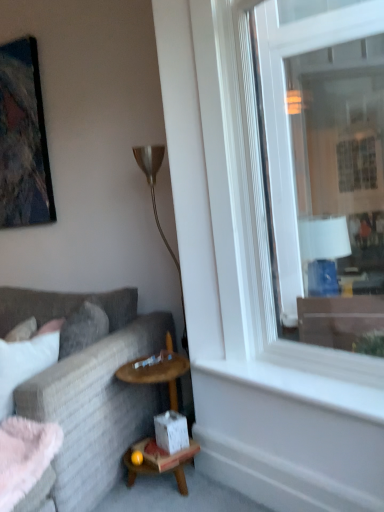
Question: Is metallic gold floor lamp at center turned away from clear glass window at right?

Choices:
 (A) no
 (B) yes

Answer: (A)

Question: Considering the relative sizes of metallic gold floor lamp at center and clear glass window at right in the image provided, is metallic gold floor lamp at center taller than clear glass window at right?

Choices:
 (A) yes
 (B) no

Answer: (B)

Question: Is metallic gold floor lamp at center aimed at clear glass window at right?

Choices:
 (A) yes
 (B) no

Answer: (B)

Question: Is metallic gold floor lamp at center positioned behind clear glass window at right?

Choices:
 (A) yes
 (B) no

Answer: (A)

Question: Can you confirm if metallic gold floor lamp at center is bigger than clear glass window at right?

Choices:
 (A) no
 (B) yes

Answer: (A)

Question: Is clear glass window at right a part of metallic gold floor lamp at center?

Choices:
 (A) no
 (B) yes

Answer: (A)

Question: Would you consider textured gray couch at left to be distant from matte black picture frame at upper left?

Choices:
 (A) no
 (B) yes

Answer: (B)

Question: Is textured gray couch at left to the right of matte black picture frame at upper left from the viewer's perspective?

Choices:
 (A) yes
 (B) no

Answer: (A)

Question: Is the surface of textured gray couch at left in direct contact with matte black picture frame at upper left?

Choices:
 (A) no
 (B) yes

Answer: (A)

Question: Is textured gray couch at left positioned with its back to matte black picture frame at upper left?

Choices:
 (A) no
 (B) yes

Answer: (A)

Question: Does textured gray couch at left lie in front of matte black picture frame at upper left?

Choices:
 (A) yes
 (B) no

Answer: (A)

Question: From the image's perspective, is textured gray couch at left beneath matte black picture frame at upper left?

Choices:
 (A) yes
 (B) no

Answer: (A)

Question: Is the surface of metallic gold floor lamp at center in direct contact with white smooth window sill at lower right?

Choices:
 (A) no
 (B) yes

Answer: (A)